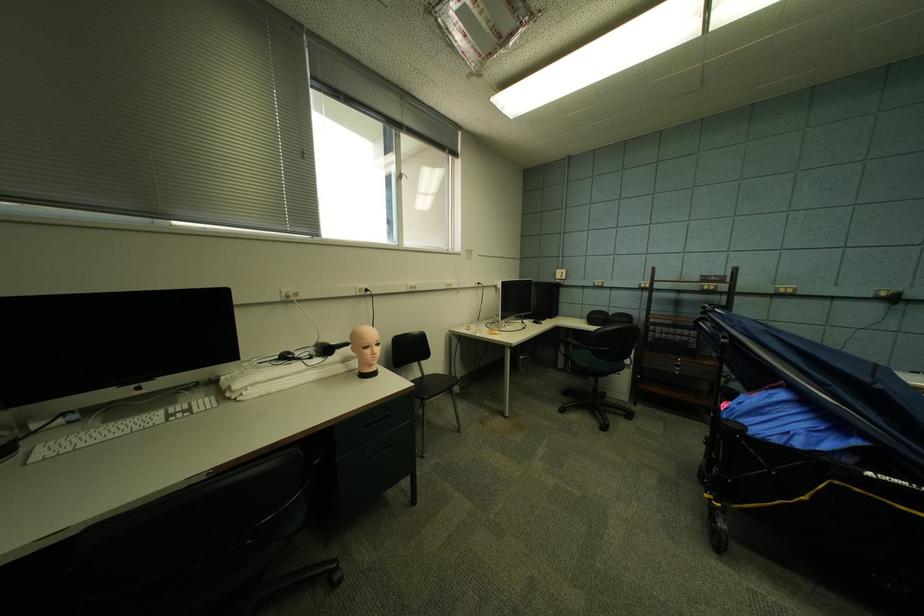
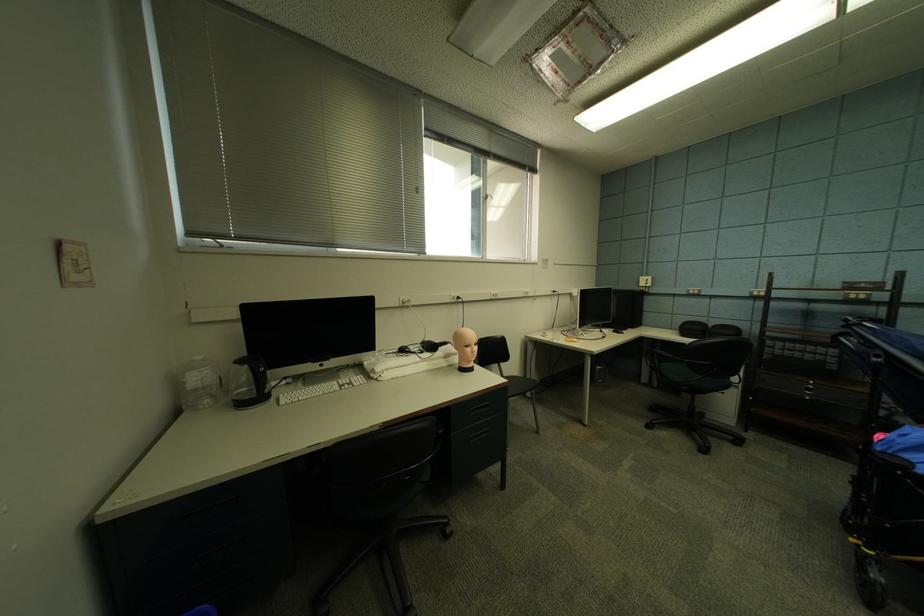
In the second image, find the point that corresponds to point (375, 349) in the first image.

(477, 347)